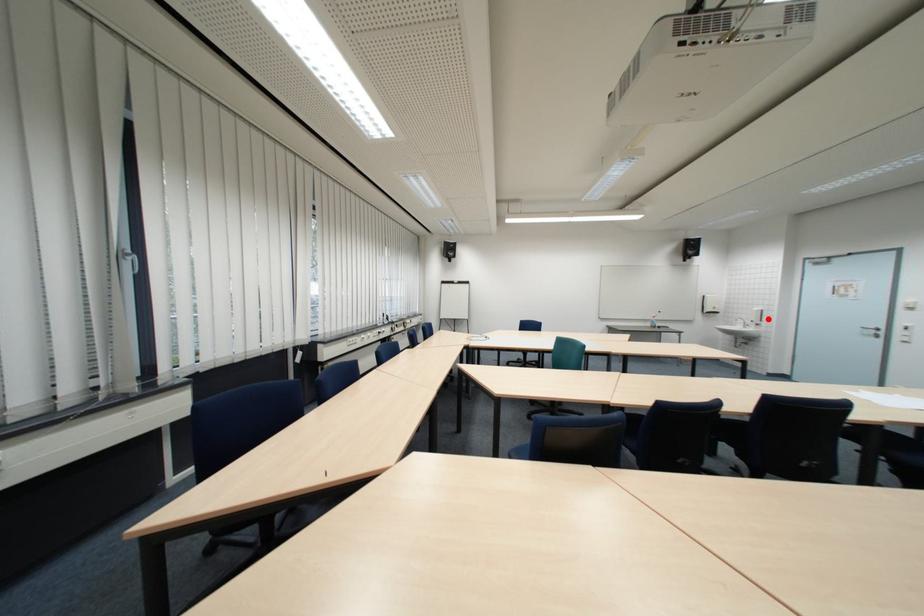
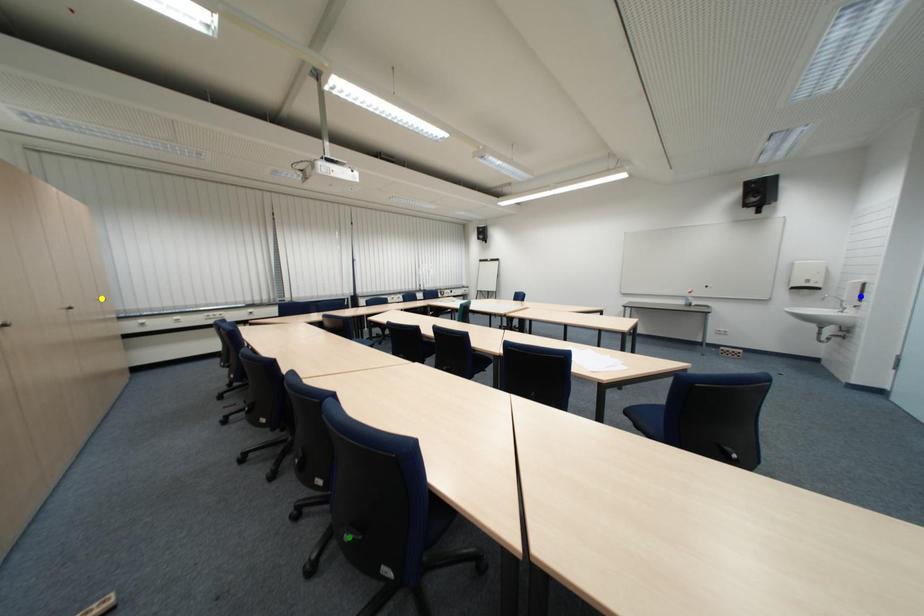
Question: I am providing you with two images of the same scene from different viewpoints. A red point is marked on the first image. You are given multiple points on the second image. Which mark in image 2 goes with the point in image 1?

Choices:
 (A) green point
 (B) yellow point
 (C) blue point

Answer: (C)